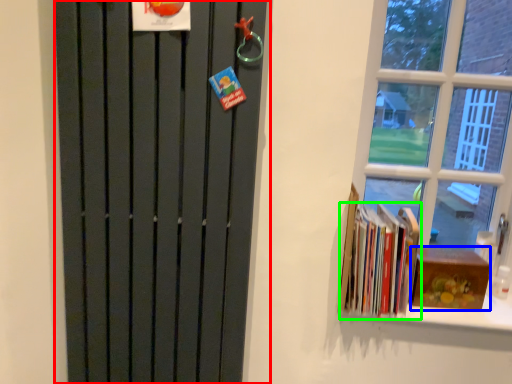
Question: Which object is the farthest from door (highlighted by a red box)? Choose among these: paperback book (highlighted by a blue box) or book (highlighted by a green box).

Choices:
 (A) paperback book
 (B) book

Answer: (A)